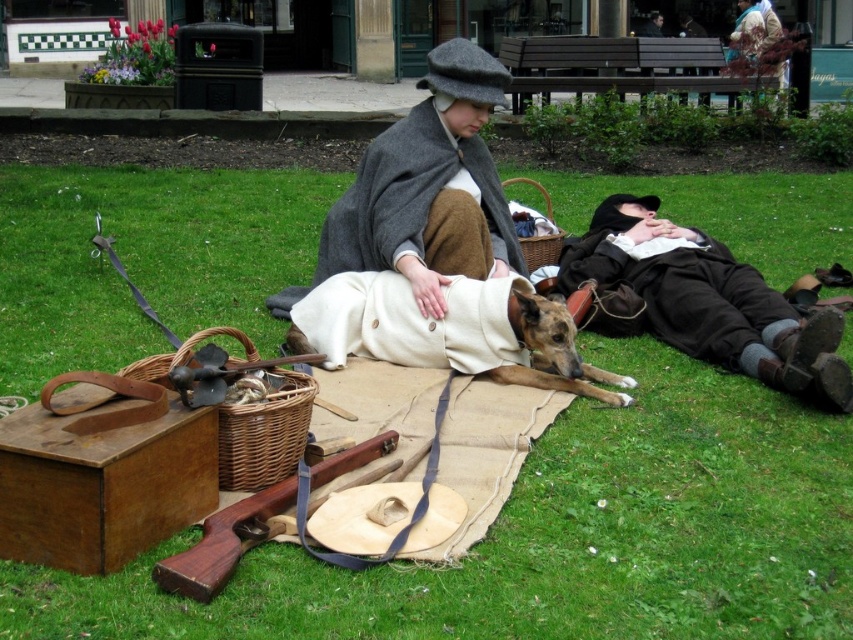
Does point (621, 460) lie behind point (239, 436)?

Yes, it is.

Describe the element at coordinates (558, 536) in the screenshot. This screenshot has height=640, width=853. I see `green grass at center` at that location.

In order to click on green grass at center in this screenshot , I will do `click(558, 536)`.

Is point (396, 253) less distant than point (306, 477)?

No, it is not.

Is gray woolen cape at center thinner than wooden rifle at lower left?

No.

Between point (321, 227) and point (392, 444), which one is positioned in front?

Point (392, 444) is in front.

At what (x,y) coordinates should I click in order to perform the action: click on gray woolen cape at center. Please return your answer as a coordinate pair (x, y). Image resolution: width=853 pixels, height=640 pixels. Looking at the image, I should click on coord(410,196).

Is the position of green grass at center more distant than that of white woolen coat at center?

Yes, it is behind white woolen coat at center.

Which is behind, point (531, 605) or point (320, 333)?

The point (320, 333) is more distant.

Identify the location of green grass at center. (558, 536).